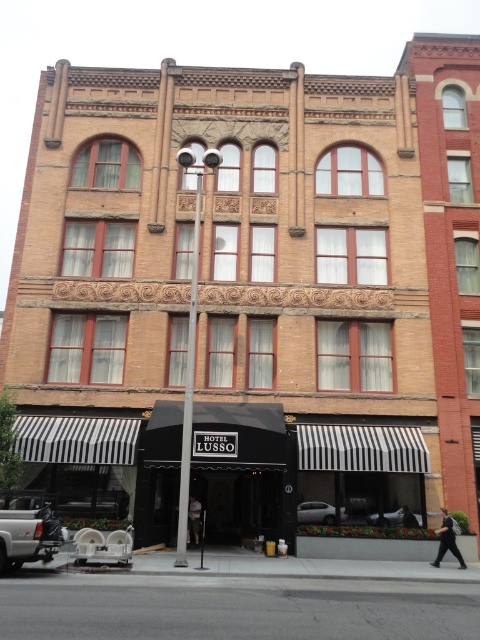
Is black awning at center bigger than silver metallic sedan at center?

Actually, black awning at center might be smaller than silver metallic sedan at center.

Is black awning at center behind silver metallic sedan at center?

No, it is not.

Identify the location of black awning at center. The image size is (480, 640). (239, 467).

In order to click on black awning at center in this screenshot , I will do `click(239, 467)`.

Can you confirm if black awning at center is positioned above black smooth jacket at lower right?

Yes, black awning at center is above black smooth jacket at lower right.

Who is positioned more to the left, black awning at center or black smooth jacket at lower right?

From the viewer's perspective, black awning at center appears more on the left side.

Who is more forward, (248,449) or (435,557)?

Point (435,557) is more forward.

This screenshot has width=480, height=640. I want to click on black awning at center, so click(239, 467).

Can you confirm if metallic pole at center is bigger than black smooth jacket at lower right?

Indeed, metallic pole at center has a larger size compared to black smooth jacket at lower right.

Is metallic pole at center above black smooth jacket at lower right?

Yes.

Which is in front, point (180, 557) or point (441, 547)?

Point (180, 557) is in front.

The width and height of the screenshot is (480, 640). I want to click on metallic pole at center, so click(x=189, y=388).